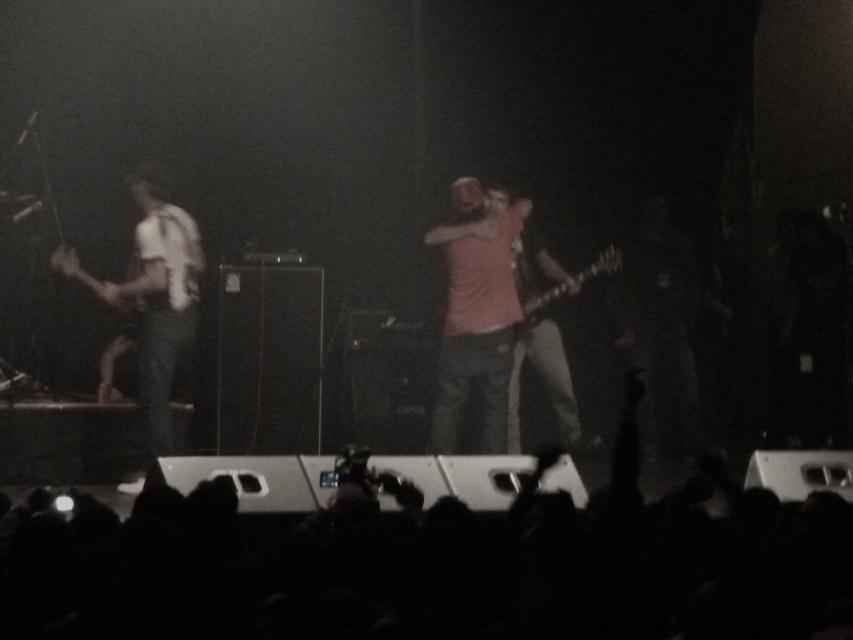
You are a photographer at the concert and want to capture both the guitarist and the drummer in your shot. The guitarist is at point (x=189, y=328) and the drummer is at point (x=614, y=252). Since the stage is dark, you need to adjust your camera settings. Which musician should you focus on first to ensure both are in focus?

You should focus on the guitarist at point (x=189, y=328) first because it is closer to the camera than the drummer at point (x=614, y=252). By focusing on the closer subject, the depth of field may also keep the drummer in focus.

You are a photographer capturing the stage from the audience. You notice the white matte shirt at left and the shiny black electric guitar at center. Which object is higher in the frame?

The white matte shirt at left is taller than the shiny black electric guitar at center, so the white matte shirt at left is higher in the frame.